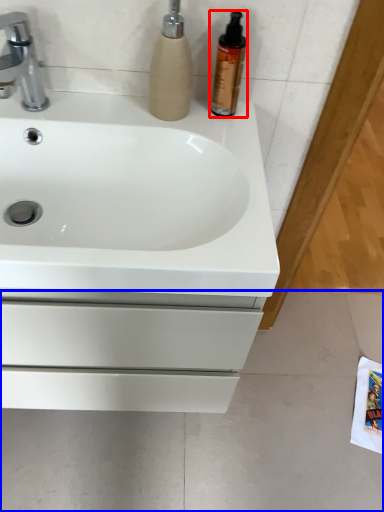
Question: Which point is further to the camera, cleaning product (highlighted by a red box) or concrete (highlighted by a blue box)?

Choices:
 (A) cleaning product
 (B) concrete

Answer: (B)